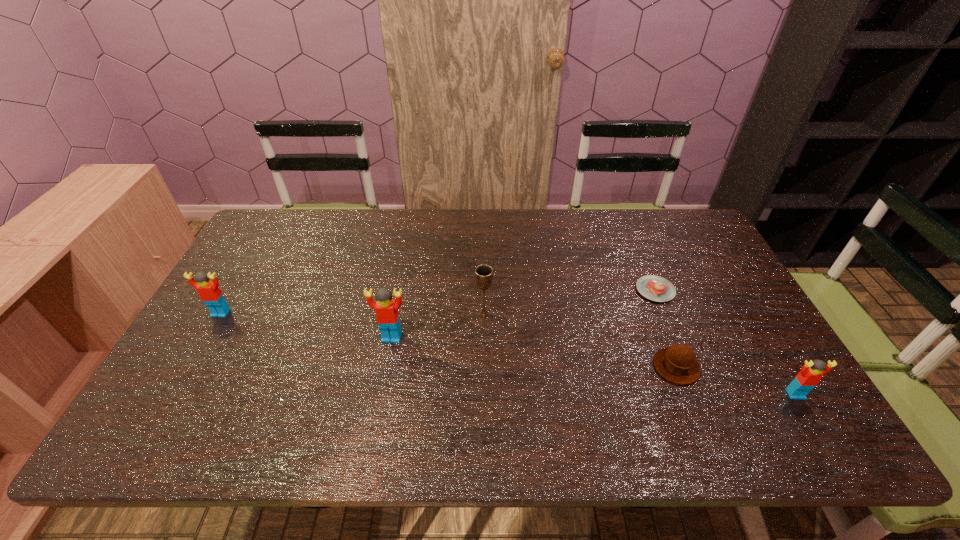
Please point a location where one more Lego can be added evenly. Please provide its 2D coordinates. Your answer should be formatted as a tuple, i.e. [(x, y)], where the tuple contains the x and y coordinates of a point satisfying the conditions above.

[(582, 364)]